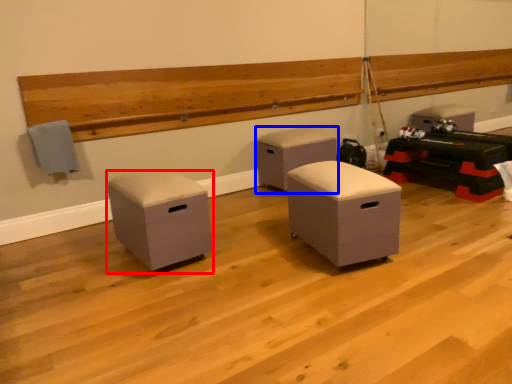
Question: Among these objects, which one is farthest to the camera, furniture (highlighted by a red box) or furniture (highlighted by a blue box)?

Choices:
 (A) furniture
 (B) furniture

Answer: (B)